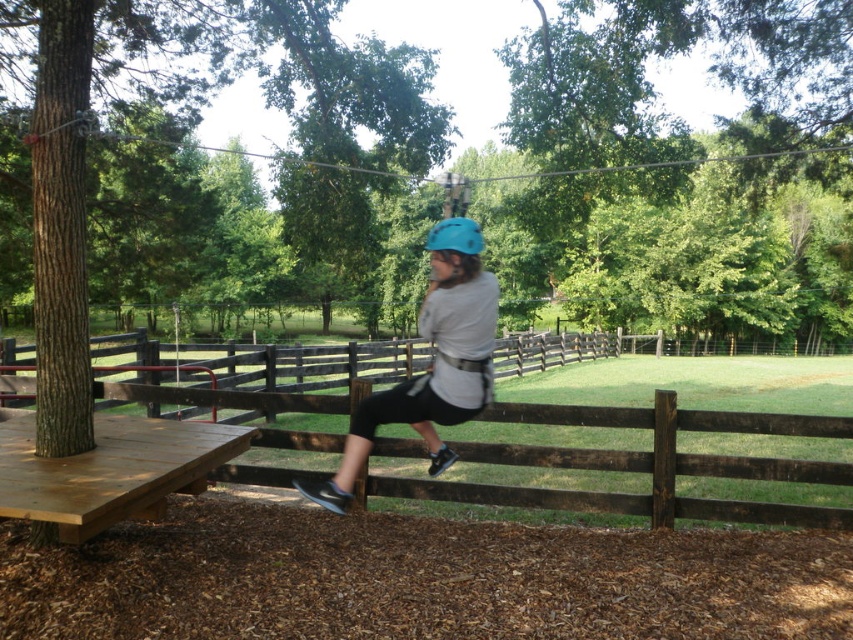
Question: Does brown wooden fence at center appear on the right side of light brown wooden picnic table at lower left?

Choices:
 (A) yes
 (B) no

Answer: (A)

Question: Does brown wooden fence at center have a greater width compared to light brown wooden picnic table at lower left?

Choices:
 (A) yes
 (B) no

Answer: (B)

Question: Which of these objects is positioned closest to the matte blue helmet at center?

Choices:
 (A) brown wooden fence at center
 (B) light brown wooden picnic table at lower left

Answer: (B)

Question: Is brown wooden fence at center above light brown wooden picnic table at lower left?

Choices:
 (A) no
 (B) yes

Answer: (B)

Question: Which object is the farthest from the light brown wooden picnic table at lower left?

Choices:
 (A) matte blue helmet at center
 (B) brown wooden fence at center

Answer: (B)

Question: Which object is closer to the camera taking this photo?

Choices:
 (A) light brown wooden picnic table at lower left
 (B) brown wooden fence at center
 (C) matte blue helmet at center

Answer: (A)